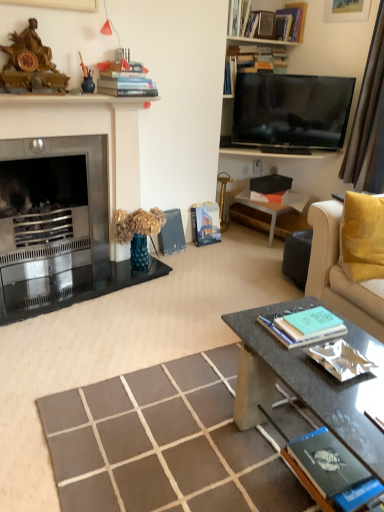
Question: From the image's perspective, is flat screen tv at upper right positioned above or below hardcover books at upper center, marked as the eighth book in a bottom-to-top arrangement?

Choices:
 (A) above
 (B) below

Answer: (B)

Question: In terms of size, does flat screen tv at upper right appear bigger or smaller than hardcover books at upper center, marked as the eighth book in a bottom-to-top arrangement?

Choices:
 (A) small
 (B) big

Answer: (B)

Question: Estimate the real-world distances between objects in this image. Which object is farther from the flat screen tv at upper right?

Choices:
 (A) soft yellow fabric couch at right
 (B) orange matte book at right, marked as the sixth book in a bottom-to-top arrangement
 (C) shiny metallic book at center-right, the eighth book positioned from the top
 (D) teal matte book at center, which is the 7th book from top to bottom
 (E) brown fabric curtain at right

Answer: (C)

Question: Which is nearer to the hardcover book at center, the 4th book when ordered from bottom to top?

Choices:
 (A) hardcover books at upper center, which appears as the 7th book when ordered from the bottom
 (B) dark gray concrete coffee table at lower right
 (C) metallic silver side table at center right
 (D) soft yellow fabric couch at right
 (E) hardcover book at center, acting as the fifth book starting from the bottom

Answer: (E)